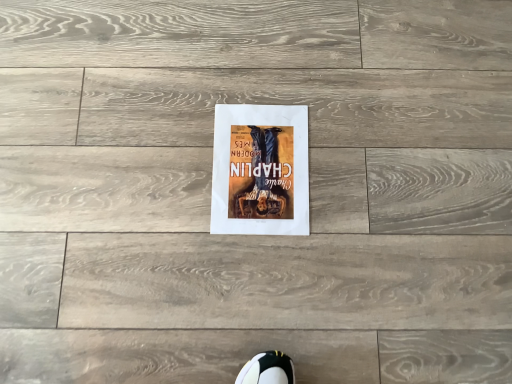
Locate an element on the screen. The image size is (512, 384). vacant point above matte paper poster at center (from a real-world perspective) is located at coordinates (254, 158).